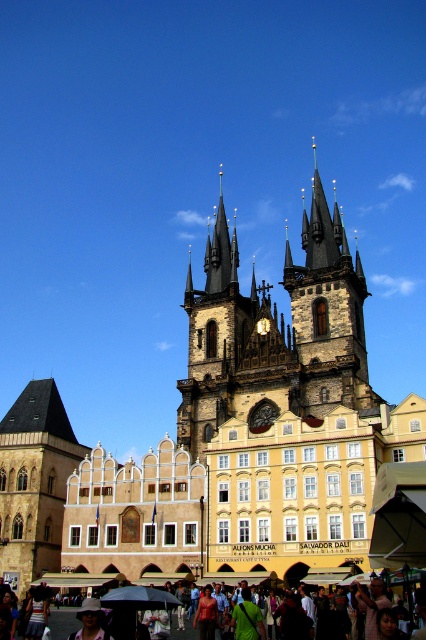
Question: Does dark brown stone tower at center appear on the left side of dark gray stone tower at lower left?

Choices:
 (A) yes
 (B) no

Answer: (B)

Question: Based on their relative distances, which object is nearer to the dark brown stone tower at center?

Choices:
 (A) white cotton hat at lower left
 (B) brown stone clock tower at center
 (C) matte black umbrella at lower center
 (D) brown stone church at center

Answer: (B)

Question: Is brown stone clock tower at center positioned behind matte black umbrella at lower center?

Choices:
 (A) no
 (B) yes

Answer: (B)

Question: Which object is farther from the camera taking this photo?

Choices:
 (A) matte black umbrella at lower center
 (B) dark gray stone tower at lower left
 (C) brown stone clock tower at center

Answer: (B)

Question: Is brown stone church at center bigger than dark gray stone tower at lower left?

Choices:
 (A) no
 (B) yes

Answer: (B)

Question: Which object is the closest to the matte black umbrella at lower center?

Choices:
 (A) brown stone church at center
 (B) dark brown stone tower at center

Answer: (A)